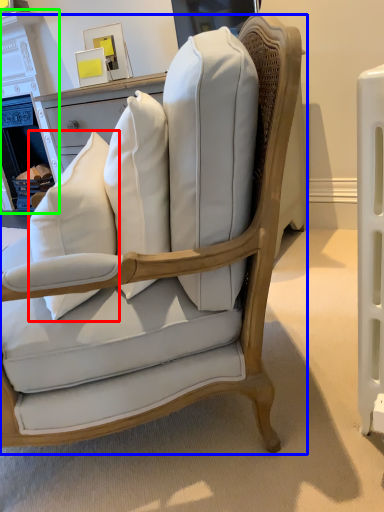
Question: Which is nearer to the throw pillow (highlighted by a red box)? chair (highlighted by a blue box) or fireplace (highlighted by a green box).

Choices:
 (A) chair
 (B) fireplace

Answer: (A)